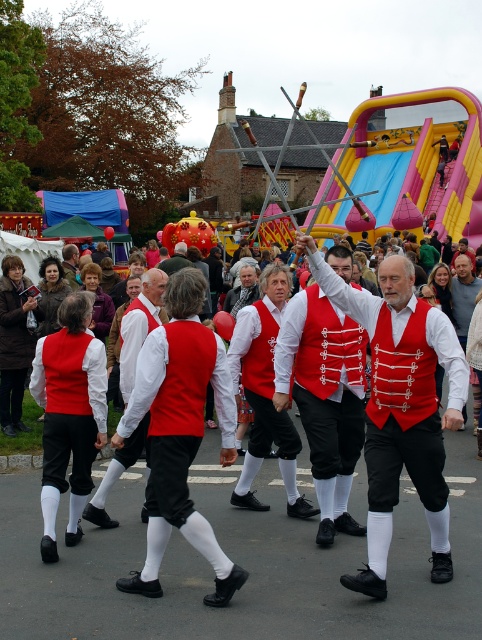
Which is below, matte red vest at center or red velvet vest at center?

matte red vest at center is below.

In the scene shown: Can you confirm if matte red vest at center is positioned to the left of red velvet vest at center?

In fact, matte red vest at center is to the right of red velvet vest at center.

Does point (383, 522) come in front of point (178, 268)?

Yes, point (383, 522) is in front of point (178, 268).

Identify the location of matte red vest at center. (401, 406).